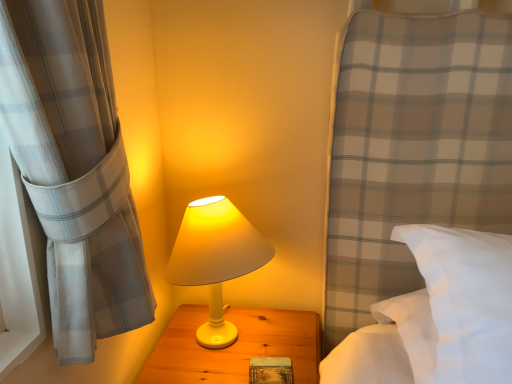
Question: Based on their sizes in the image, would you say white matte lamp at center is bigger or smaller than white matte wood nightstand at center?

Choices:
 (A) big
 (B) small

Answer: (B)

Question: From a real-world perspective, is white matte lamp at center positioned above or below white matte wood nightstand at center?

Choices:
 (A) above
 (B) below

Answer: (A)

Question: Which object is the closest to the wooden textured book at center?

Choices:
 (A) white soft pillow at right
 (B) white matte lamp at center
 (C) white matte wood nightstand at center

Answer: (C)

Question: Based on their relative distances, which object is farther from the white matte lamp at center?

Choices:
 (A) wooden textured book at center
 (B) white matte wood nightstand at center
 (C) white soft pillow at right

Answer: (C)